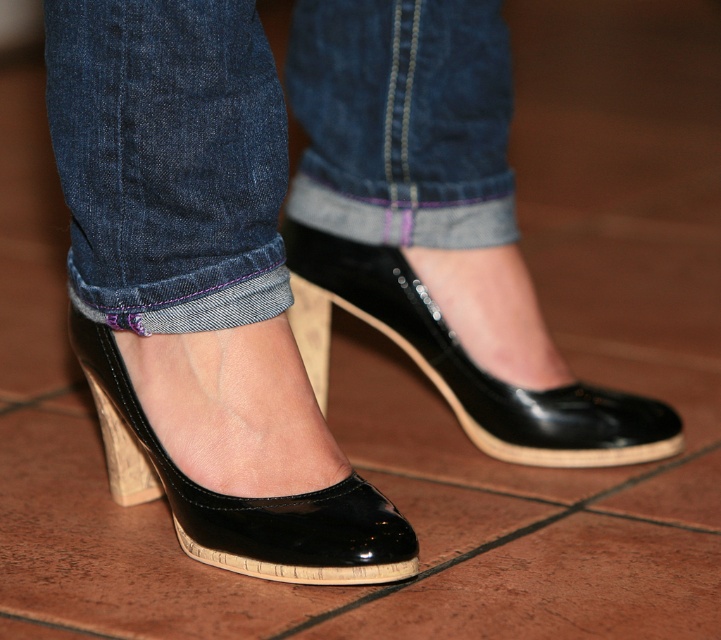
You are a fashion designer analyzing the image. You need to determine the spatial relationship between the denim at lower center and the glossy patent leather shoe at lower center. Which object is positioned higher from the ground?

The denim at lower center is positioned higher from the ground than the glossy patent leather shoe at lower center because it is above it.